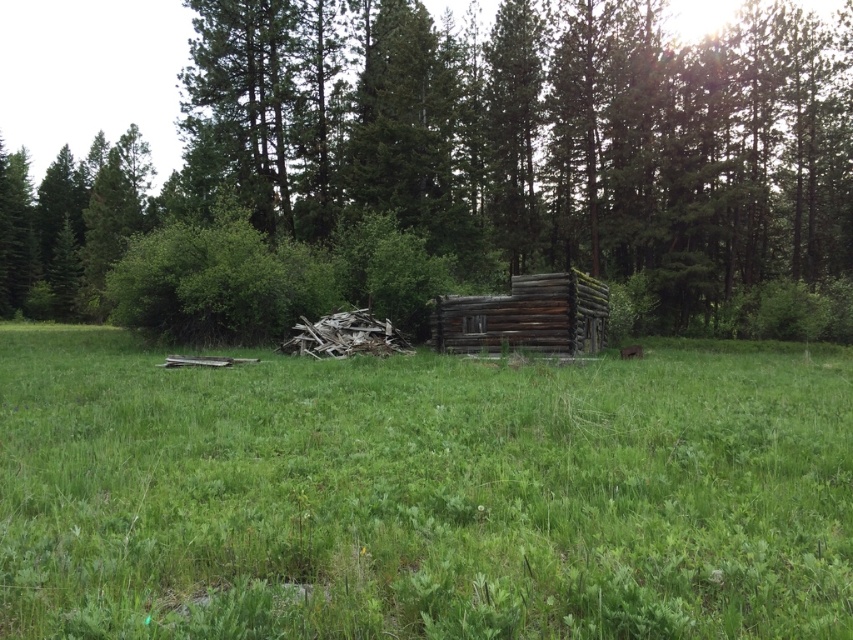
In the scene shown: You are standing at the origin point in the image. You want to reach the green grassy at center as quickly as possible. Which direction should you move in?

The green grassy at center is located at point 0.773 on the x axis and 0.495 on the y axis. Since you are at the origin point, you should move towards the northeast direction to reach it quickly.

You are standing in the middle of the green grassy at center and looking towards the weathered wood cabin at center. Which direction should you walk to reach the cabin?

Since the green grassy at center is below the weathered wood cabin at center, you should walk upwards or towards the higher elevation to reach the cabin.

You are an architect evaluating the site. You see the weathered wood cabin at center and the weathered wood log cabin at center. Which one has a greater width?

The weathered wood cabin at center has a greater width than the weathered wood log cabin at center.